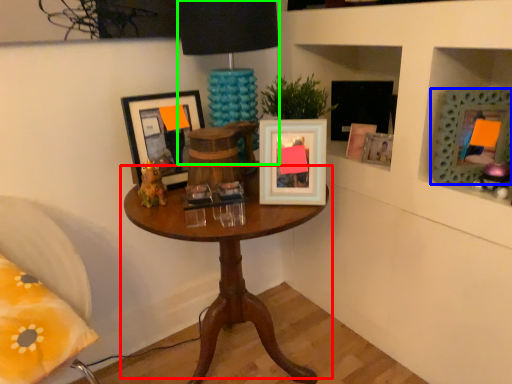
Question: Based on their relative distances, which object is nearer to table (highlighted by a red box)? Choose from picture frame (highlighted by a blue box) and table lamp (highlighted by a green box).

Choices:
 (A) picture frame
 (B) table lamp

Answer: (B)